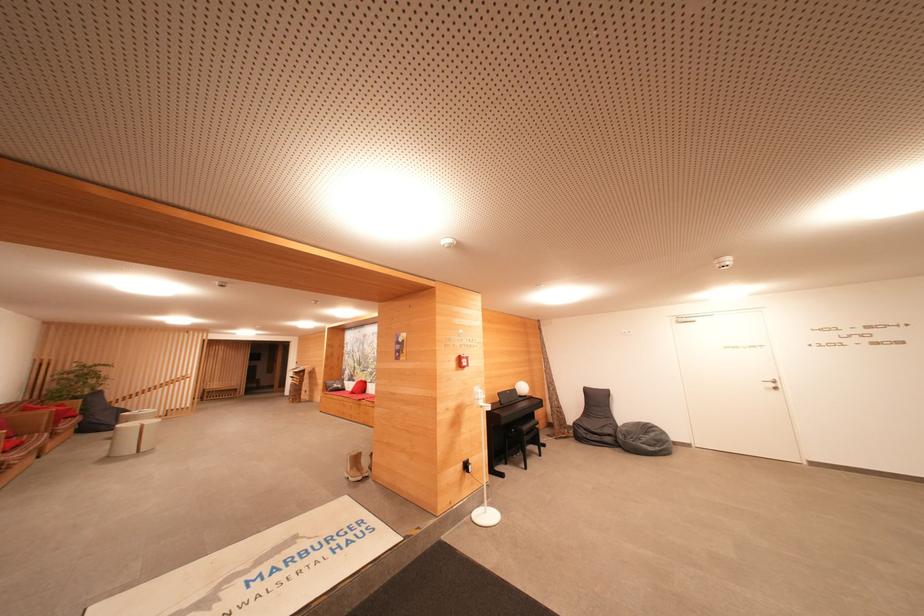
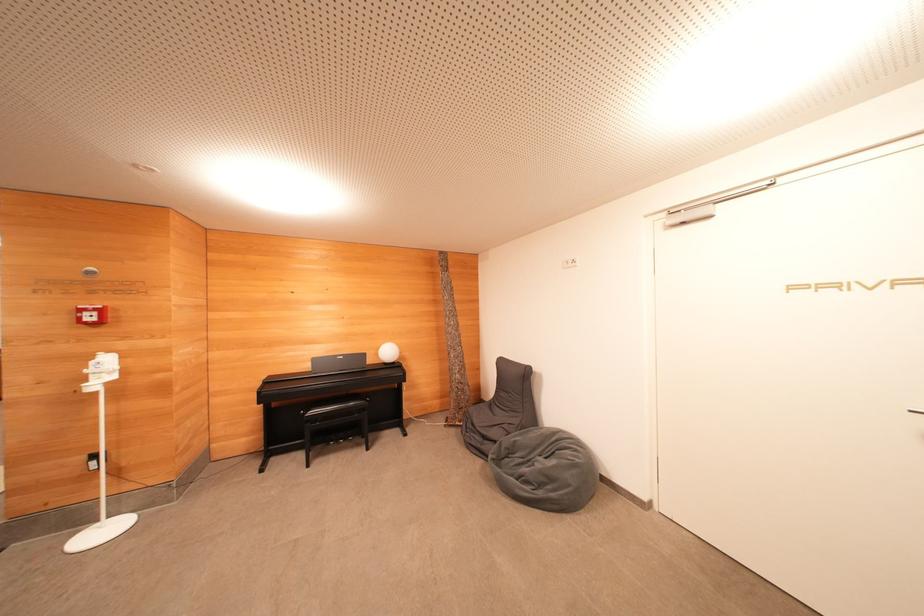
Which direction would the cameraman need to move to produce the second image?

The cameraman moved toward right, forward.